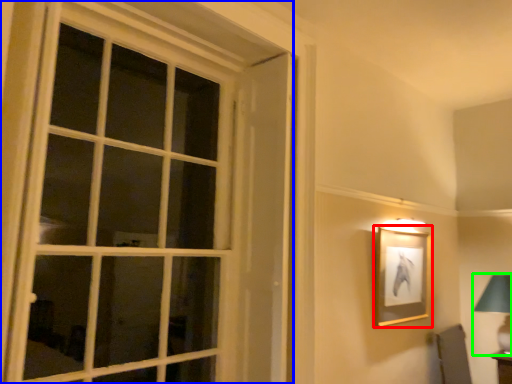
Question: Which is farther away from picture frame (highlighted by a red box)? window (highlighted by a blue box) or bedside lamp (highlighted by a green box)?

Choices:
 (A) window
 (B) bedside lamp

Answer: (A)